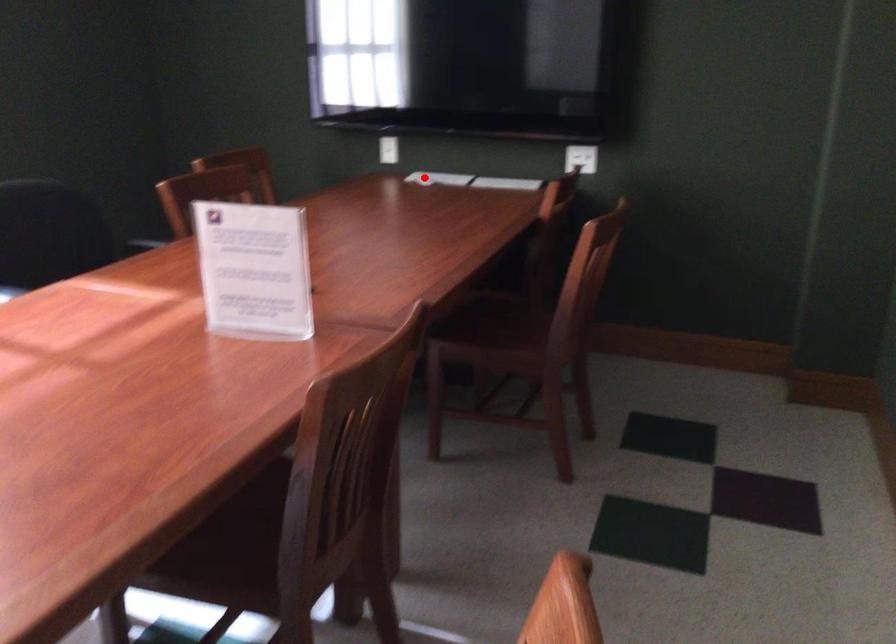
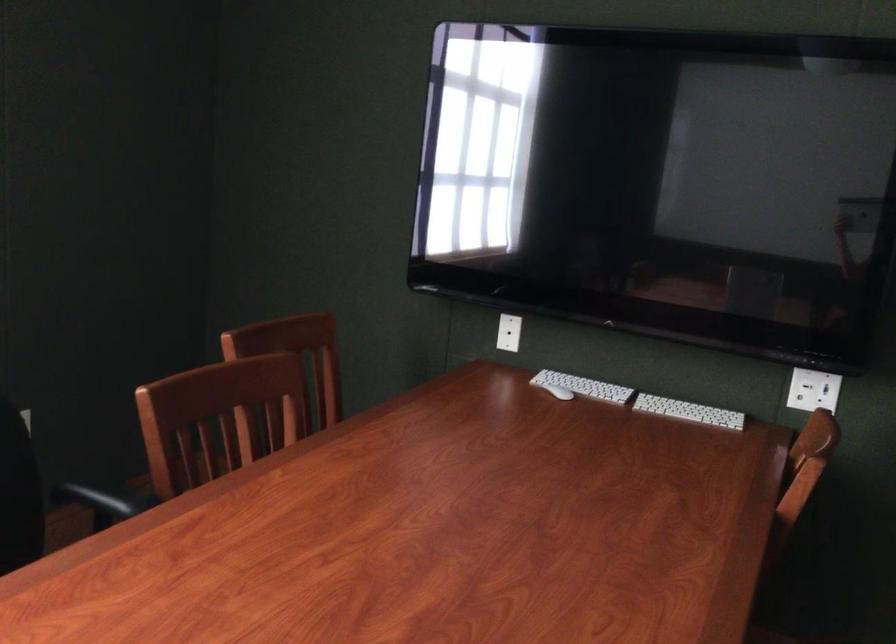
Where in the second image is the point corresponding to the highlighted location from the first image?

(558, 392)